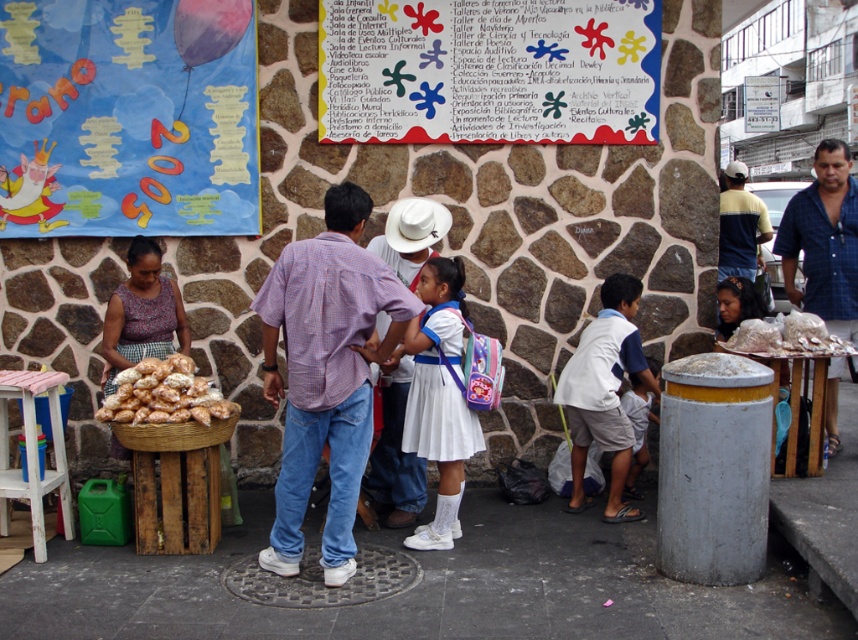
You are standing at the market in front of the stone wall with posters. There are two points marked on the ground. One is at coordinate point (587, 38) and the other at point (814, 284). If you want to move from the first point to the second point, which direction should you walk relative to the wall?

You should walk towards the wall because point (587, 38) is in front of point (814, 284).

You are standing at the market in front of the stone wall with posters. There are two points marked on the wall. One is at coordinate point (125, 307) and the other at point (752, 273). Which point is closer to you?

The point at (125, 307) is closer to you than the point at (752, 273).

You are a delivery person who needs to place a package between the white matte dress at center and the brown woven basket at lower left. The package requires a space of 1.5 meters. Can you fit it there?

The white matte dress at center and brown woven basket at lower left are 1.25 meters apart, so the package requiring 1.5 meters cannot fit between them.